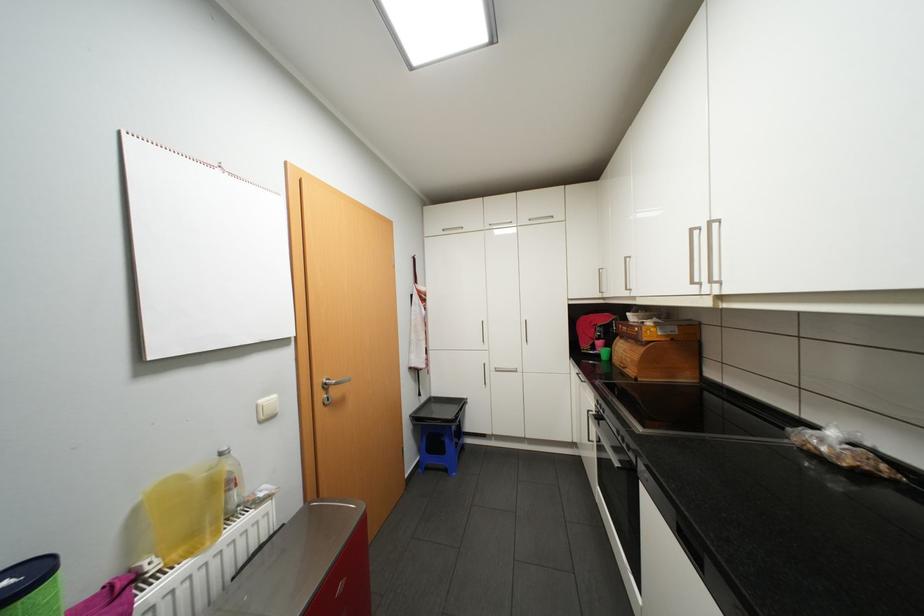
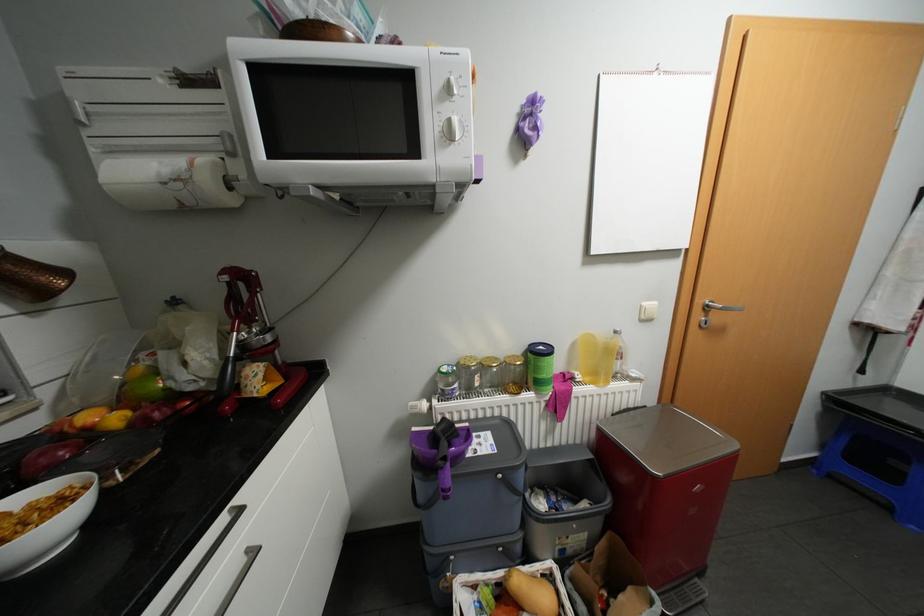
Where in the second image is the point corresponding to (162,565) from the first image?

(587, 377)